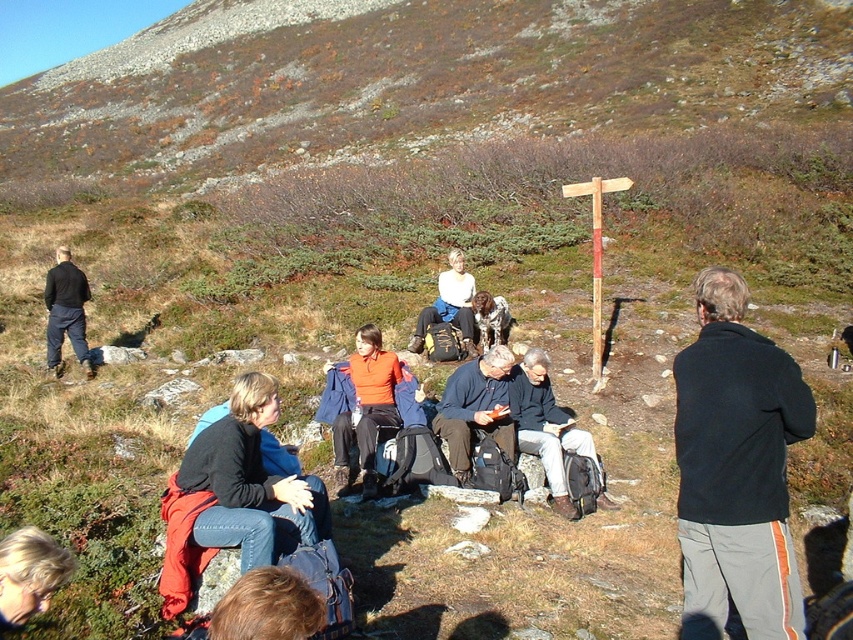
Looking at this image, is blonde hair at lower center thinner than dark blue jeans at left?

Correct, blonde hair at lower center's width is less than dark blue jeans at left's.

Is point (263, 588) positioned after point (57, 362)?

No.

This screenshot has width=853, height=640. I want to click on blonde hair at lower center, so click(268, 608).

Does black sweater at center have a lesser width compared to orange fleece jacket at center?

Indeed, black sweater at center has a lesser width compared to orange fleece jacket at center.

Who is taller, black sweater at center or orange fleece jacket at center?

With more height is orange fleece jacket at center.

Is point (257, 472) farther from viewer compared to point (345, 465)?

No, it is not.

Identify the location of black sweater at center. This screenshot has width=853, height=640. (250, 481).

Which of these two, orange fleece jacket at center or dark blue jeans at left, stands shorter?

orange fleece jacket at center

How far apart are orange fleece jacket at center and dark blue jeans at left?

orange fleece jacket at center and dark blue jeans at left are 5.74 meters apart.

Who is more forward, (375, 483) or (73, 320)?

Point (375, 483) is in front.

This screenshot has width=853, height=640. What are the coordinates of `orange fleece jacket at center` in the screenshot? It's located at (364, 406).